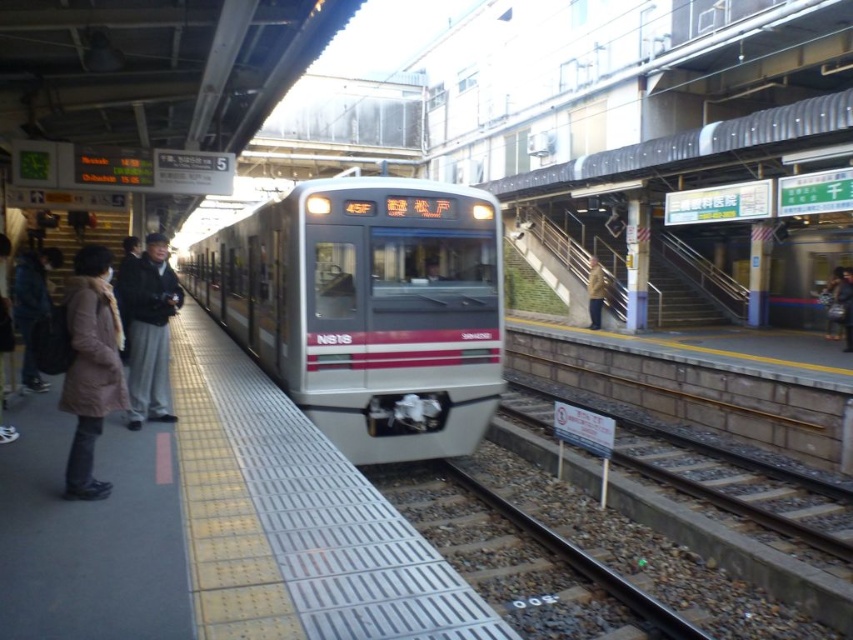
Question: Can you confirm if dark gray fabric jacket at left is thinner than brown leather jacket at center?

Choices:
 (A) no
 (B) yes

Answer: (A)

Question: Is dark gray fabric jacket at left in front of brown leather jacket at center?

Choices:
 (A) no
 (B) yes

Answer: (B)

Question: Which point appears closest to the camera in this image?

Choices:
 (A) (357, 401)
 (B) (602, 275)
 (C) (149, 328)

Answer: (C)

Question: Does silver metallic train at center appear on the left side of dark gray fabric jacket at left?

Choices:
 (A) yes
 (B) no

Answer: (A)

Question: Which of the following is the farthest from the observer?

Choices:
 (A) silver metallic train at center
 (B) brown leather jacket at center
 (C) dark gray fabric jacket at left

Answer: (B)

Question: Among these objects, which one is nearest to the camera?

Choices:
 (A) silver metallic train at center
 (B) brown leather jacket at center
 (C) dark gray fabric jacket at left

Answer: (C)